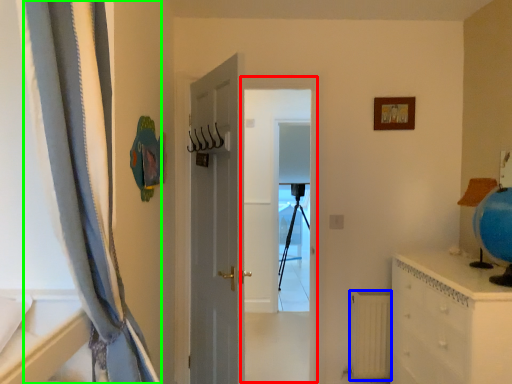
Question: Which object is the closest to the screen door (highlighted by a red box)? Choose among these: radiator (highlighted by a blue box) or curtain (highlighted by a green box).

Choices:
 (A) radiator
 (B) curtain

Answer: (A)